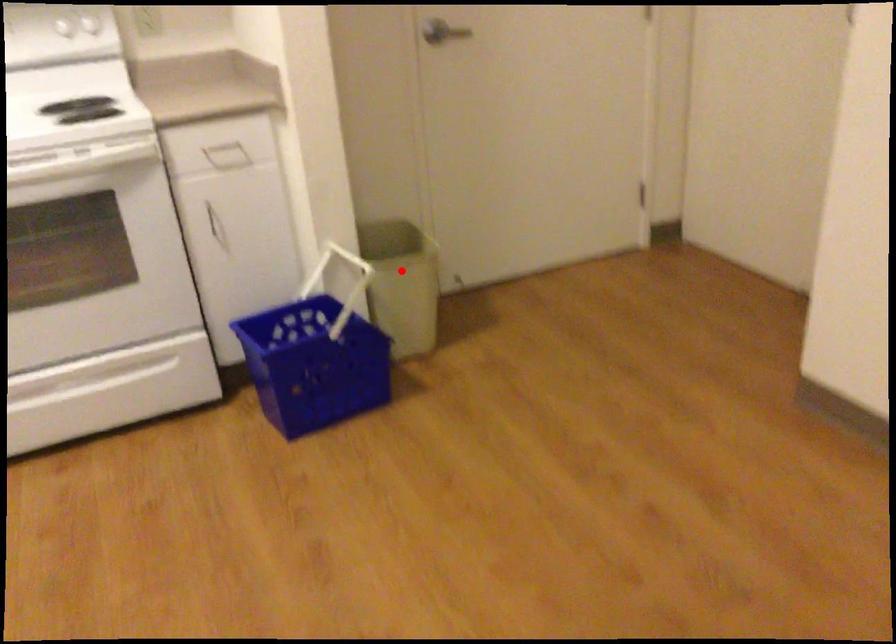
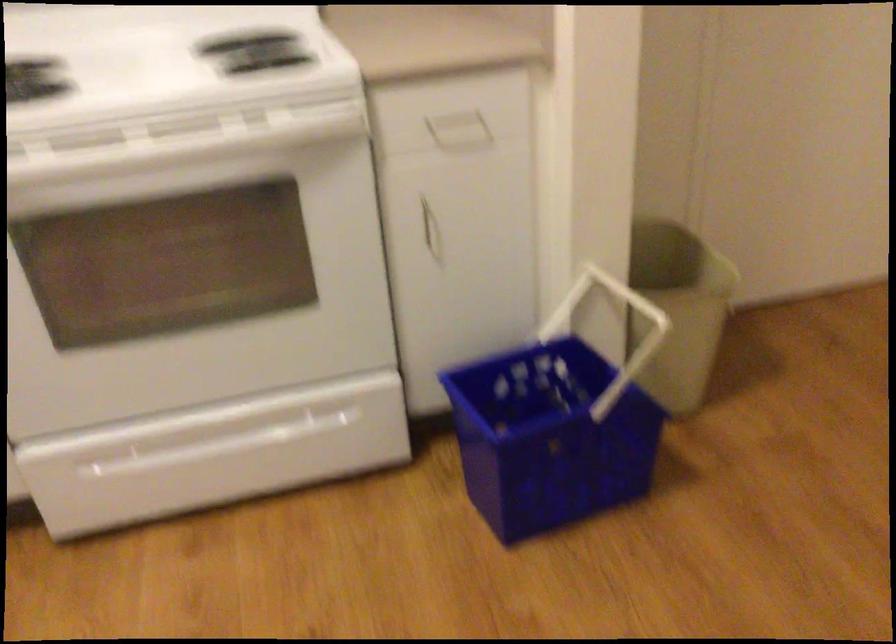
Question: I am providing you with two images of the same scene from different viewpoints. Given a red point in image1, look at the same physical point in image2. Is it:

Choices:
 (A) Closer to the viewpoint
 (B) Farther from the viewpoint

Answer: (A)